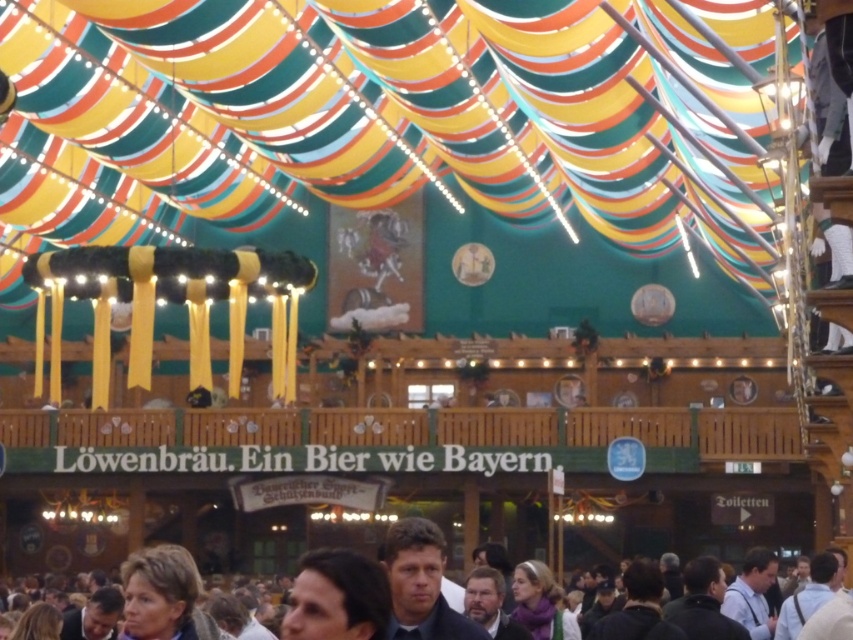
Looking at this image, does dark brown hair at center appear on the left side of bearded man at center?

Indeed, dark brown hair at center is positioned on the left side of bearded man at center.

What do you see at coordinates (337, 596) in the screenshot? I see `dark brown hair at center` at bounding box center [337, 596].

Who is more distant from viewer, (x=318, y=600) or (x=482, y=593)?

Point (x=482, y=593)

Identify the location of dark brown hair at center. (337, 596).

Between point (421, 573) and point (144, 628), which one is positioned behind?

The point (421, 573) is more distant.

Who is shorter, blue denim shirt at center or smooth brown hair at lower left?

Standing shorter between the two is blue denim shirt at center.

Identify the location of blue denim shirt at center. Image resolution: width=853 pixels, height=640 pixels. click(x=421, y=584).

Between blue denim shirt at center and dark gray jacket at lower right, which one has less height?

dark gray jacket at lower right

Is blue denim shirt at center taller than dark gray jacket at lower right?

Yes.

Between point (392, 538) and point (666, 605), which one is positioned behind?

The point (666, 605) is more distant.

Locate an element on the screen. Image resolution: width=853 pixels, height=640 pixels. blue denim shirt at center is located at coordinates (421, 584).